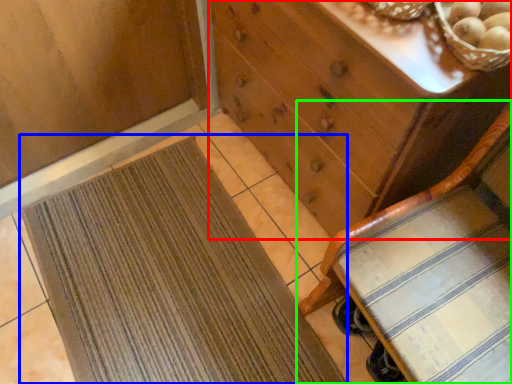
Question: Which is farther away from chest of drawers (highlighted by a red box)? mat (highlighted by a blue box) or furniture (highlighted by a green box)?

Choices:
 (A) mat
 (B) furniture

Answer: (A)